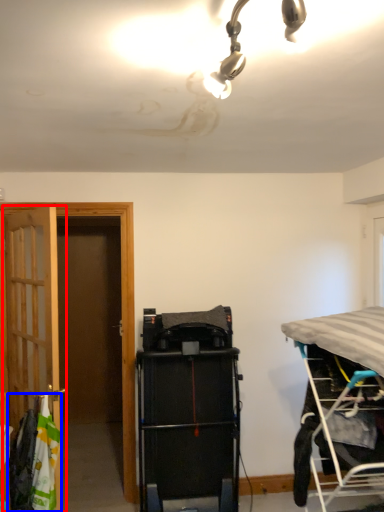
Question: Which object is closer to the camera taking this photo, door (highlighted by a red box) or laundry (highlighted by a blue box)?

Choices:
 (A) door
 (B) laundry

Answer: (B)